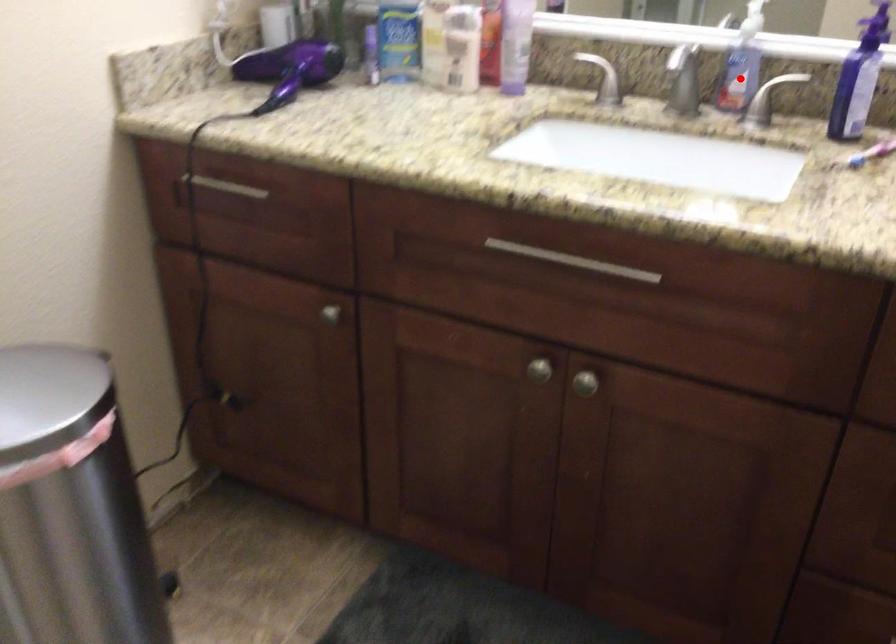
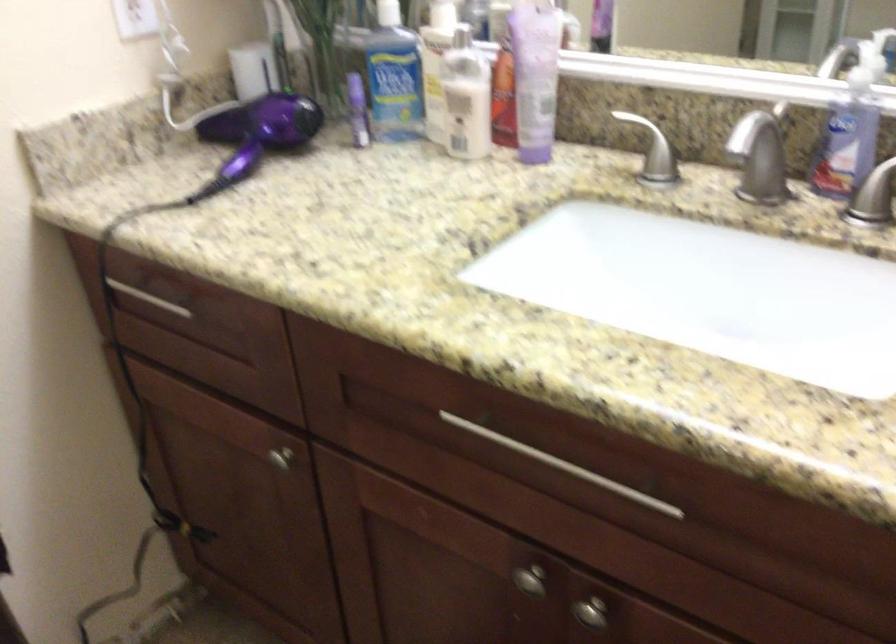
Locate, in the second image, the point that corresponds to the highlighted location in the first image.

(846, 145)